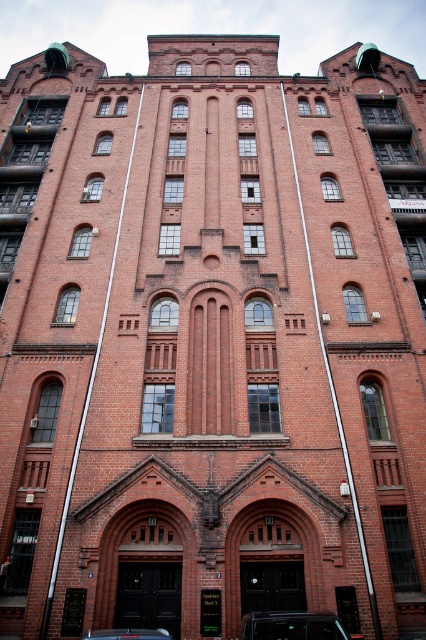
Is point (284, 620) positioned in front of point (104, 636)?

No, (284, 620) is behind (104, 636).

Locate an element on the screen. This screenshot has width=426, height=640. shiny black car at lower center is located at coordinates 291,625.